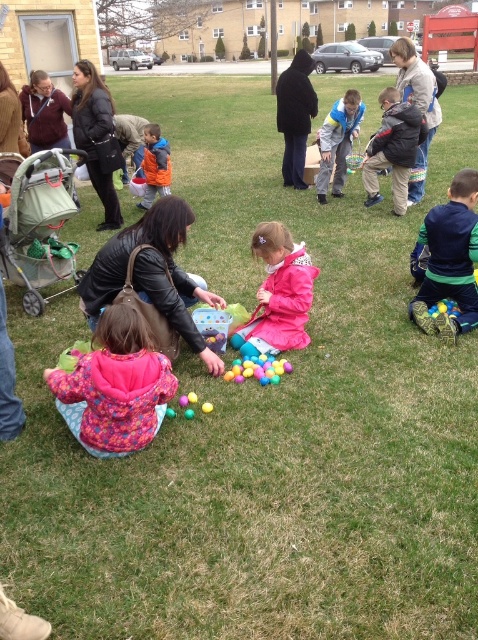
Between point (15, 241) and point (291, 280), which one is positioned in front?

Point (291, 280) is in front.

Does matte green stroller at left appear on the left side of pink matte jacket at center?

Yes, matte green stroller at left is to the left of pink matte jacket at center.

The height and width of the screenshot is (640, 478). Find the location of `matte green stroller at left`. matte green stroller at left is located at coordinates (39, 227).

Can you confirm if multicolored fabric pants at lower right is bigger than blue denim jacket at center?

Incorrect, multicolored fabric pants at lower right is not larger than blue denim jacket at center.

Is point (463, 234) farther from viewer compared to point (319, 189)?

No, it is in front of (319, 189).

Is point (427, 273) more distant than point (344, 131)?

No, (427, 273) is in front of (344, 131).

Find the location of `multicolored fabric pants at lower right`. multicolored fabric pants at lower right is located at coordinates (449, 259).

Is the position of fluffy pink jacket at lower left less distant than that of rubber yellow ball at center?

Yes, fluffy pink jacket at lower left is in front of rubber yellow ball at center.

Between fluffy pink jacket at lower left and rubber yellow ball at center, which one is positioned higher?

Positioned higher is rubber yellow ball at center.

The height and width of the screenshot is (640, 478). In order to click on fluffy pink jacket at lower left in this screenshot , I will do `click(115, 385)`.